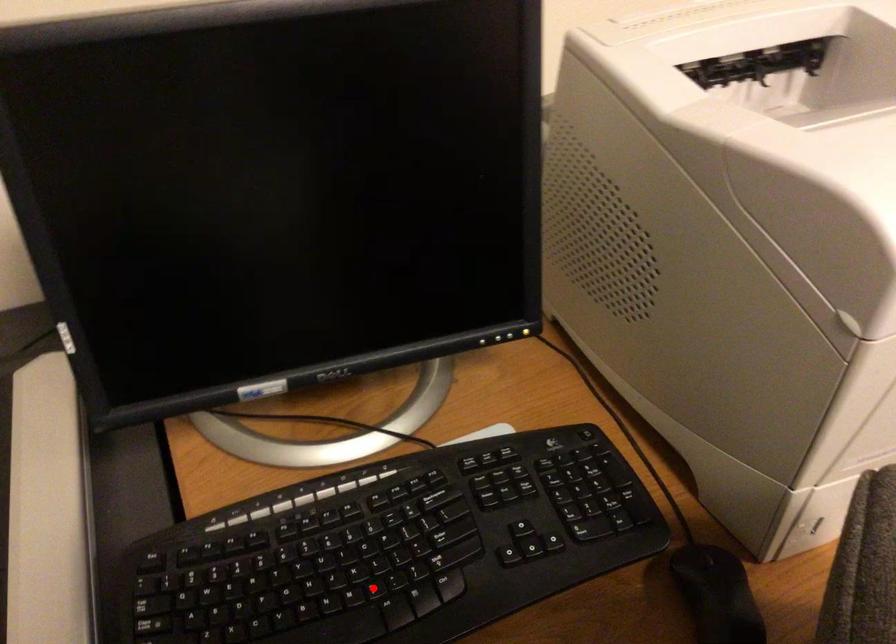
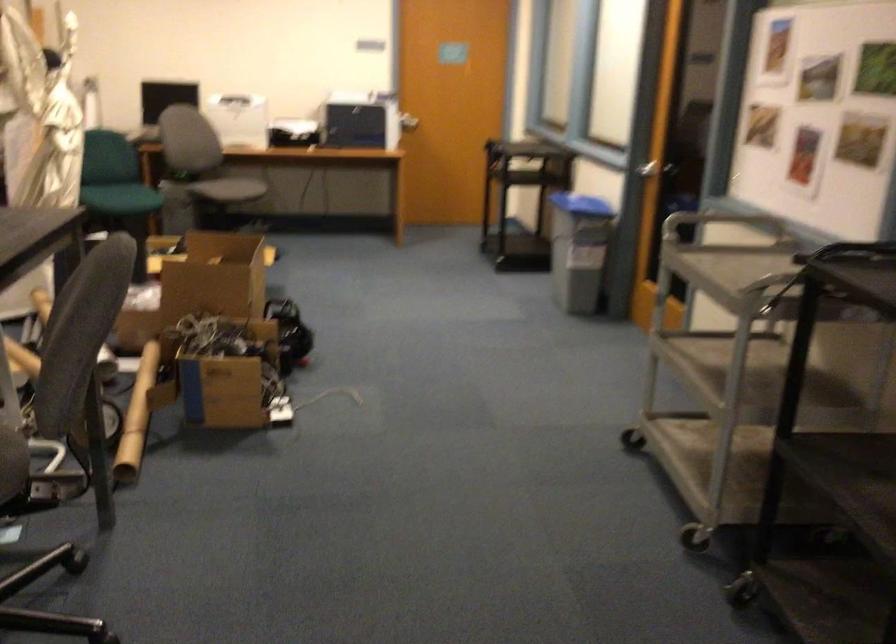
Question: I am providing you with two images of the same scene from different viewpoints. A red point is marked on the first image. At the location where the point appears in image 1, is it still visible in image 2?

Choices:
 (A) Yes
 (B) No

Answer: (B)